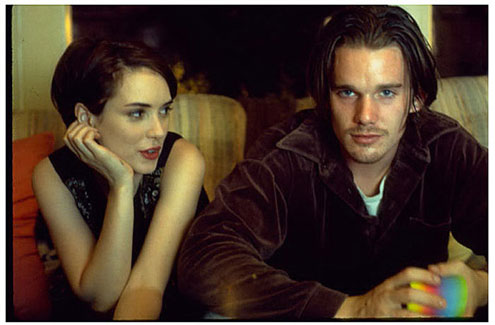
The width and height of the screenshot is (495, 325). What are the coordinates of `chairs` in the screenshot? It's located at (221, 138), (453, 105).